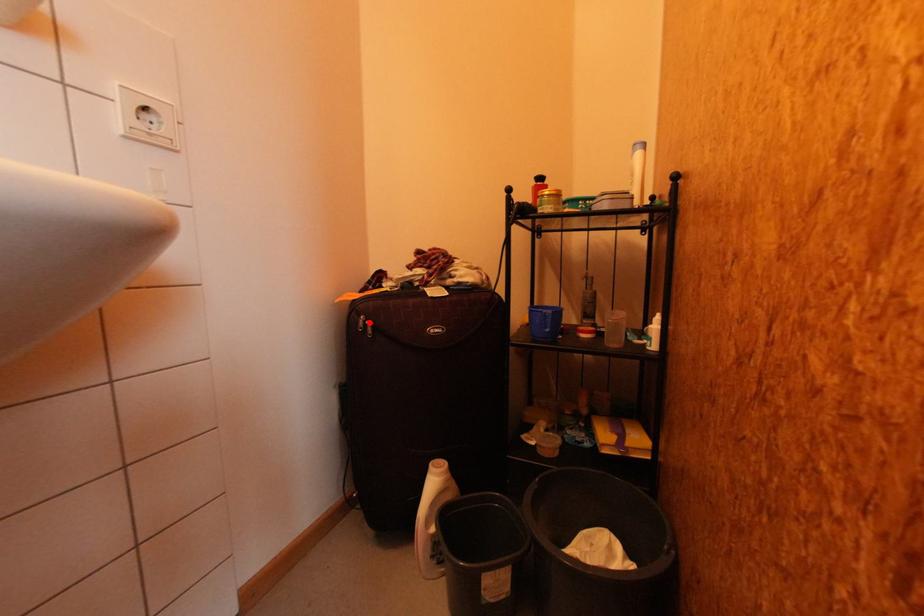
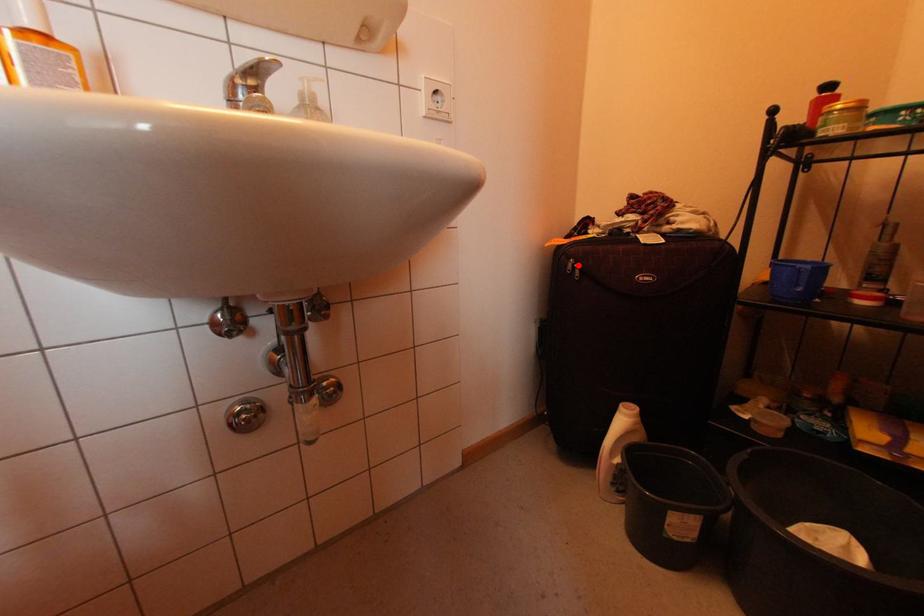
I am providing you with two images of the same scene from different viewpoints. A red point is marked on the first image and another point is marked on the second image. Is the red point in image1 aligned with the point shown in image2?

Yes